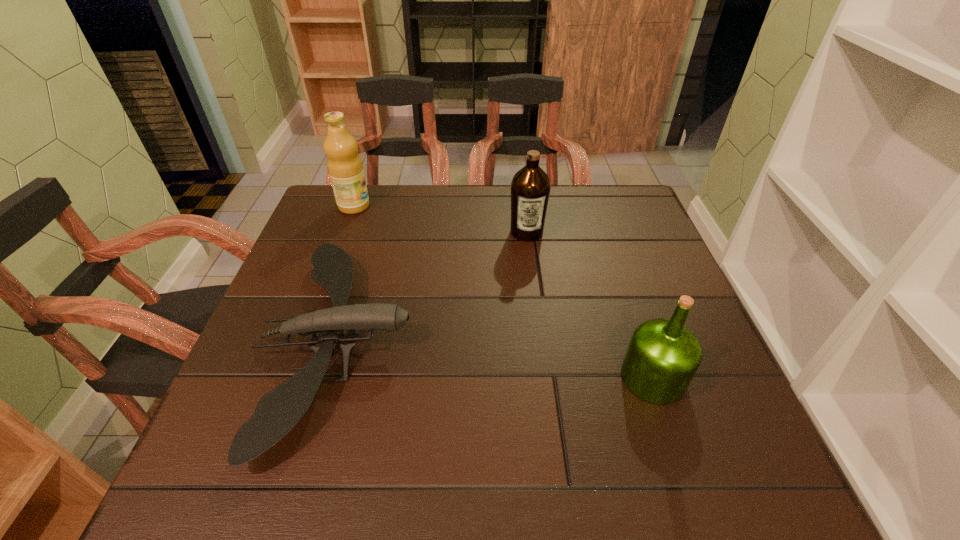
Locate an element on the screen. Image resolution: width=960 pixels, height=540 pixels. vacant position at the right edge of the desktop is located at coordinates (660, 267).

The width and height of the screenshot is (960, 540). I want to click on free region at the far left corner, so click(333, 197).

The height and width of the screenshot is (540, 960). What are the coordinates of `vacant area that lies between the drone and the rightmost object` in the screenshot? It's located at (x=495, y=360).

Image resolution: width=960 pixels, height=540 pixels. What are the coordinates of `vacant region between the farthest object and the rightmost olive oil` in the screenshot? It's located at (503, 292).

Where is `free space between the nearest olive oil and the drone`? The image size is (960, 540). free space between the nearest olive oil and the drone is located at coordinates (495, 360).

The width and height of the screenshot is (960, 540). Identify the location of unoccupied position between the second olive oil from left to right and the rightmost olive oil. (589, 305).

You are a GUI agent. You are given a task and a screenshot of the screen. Output one action in this format:
    pyautogui.click(x=<x>, y=<y>)
    Task: Click on the free area in between the nearest olive oil and the leftmost olive oil
    
    Given the screenshot: What is the action you would take?
    pyautogui.click(x=503, y=292)

This screenshot has width=960, height=540. In order to click on free point between the rightmost olive oil and the second nearest olive oil in this screenshot , I will do (x=589, y=305).

You are a GUI agent. You are given a task and a screenshot of the screen. Output one action in this format:
    pyautogui.click(x=<x>, y=<y>)
    Task: Click on the free area in between the second farthest object and the rightmost object
    The image size is (960, 540).
    Given the screenshot: What is the action you would take?
    pyautogui.click(x=589, y=305)

The width and height of the screenshot is (960, 540). What are the coordinates of `unoccupied area between the leftmost olive oil and the rightmost object` in the screenshot? It's located at (503, 292).